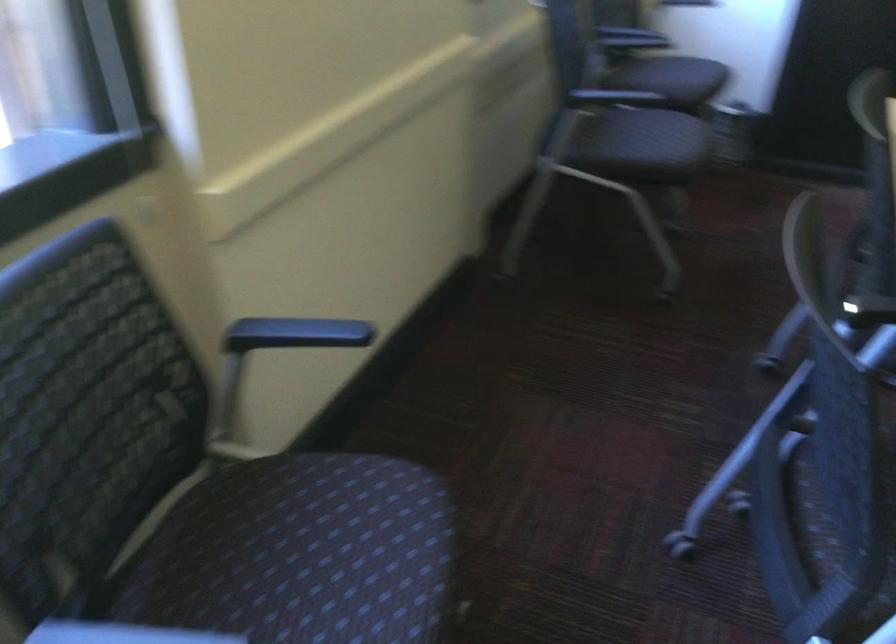
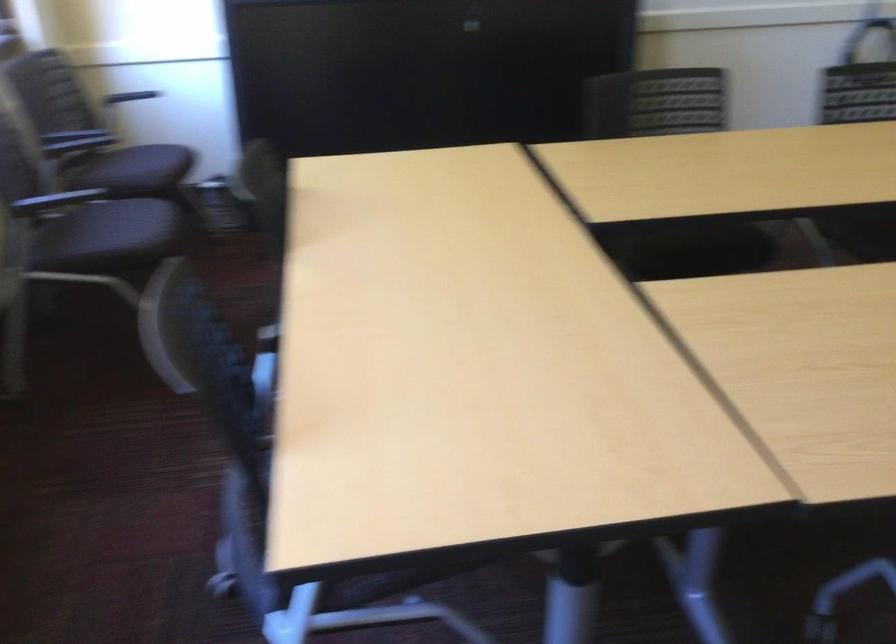
In the second image, find the point that corresponds to [670,77] in the first image.

(135, 169)